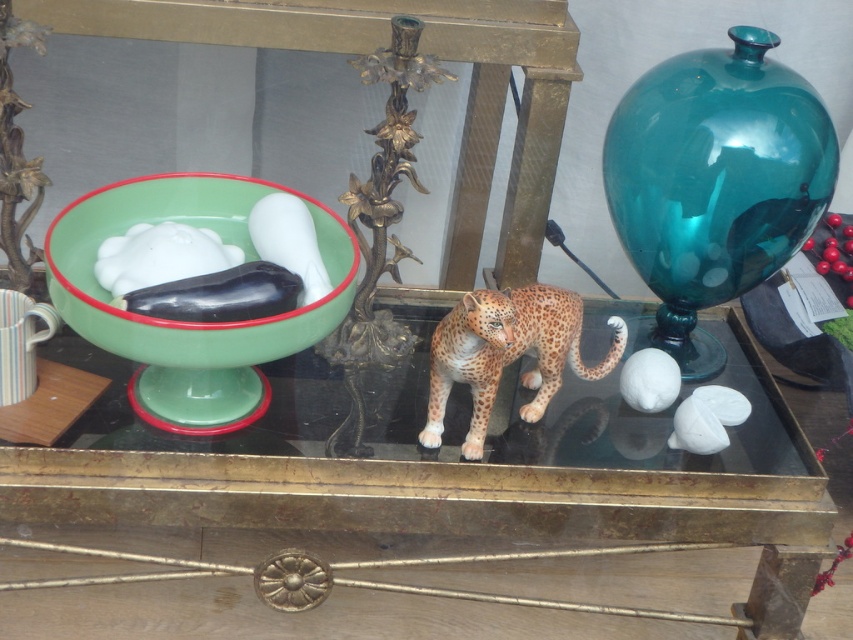
You are arranging flowers and need to place a vase between the green glass bowl at left and the spotted fur cheetah at center. Based on their positions, which object should the vase be closer to?

The vase should be placed closer to the spotted fur cheetah at center because the green glass bowl at left is closer to the viewer, meaning the cheetah is further back, so placing the vase between them would require it to be nearer to the cheetah to maintain proper spacing.

You are arranging a vase on the glossy glass table at center. The spotted fur cheetah at center is already placed there. If the vase is 15 cm in diameter, will it fit on the table without overlapping the cheetah?

The glossy glass table at center might be wider than spotted fur cheetah at center, but the exact dimensions are not provided. Therefore, it is uncertain whether the vase will fit without overlapping the cheetah.